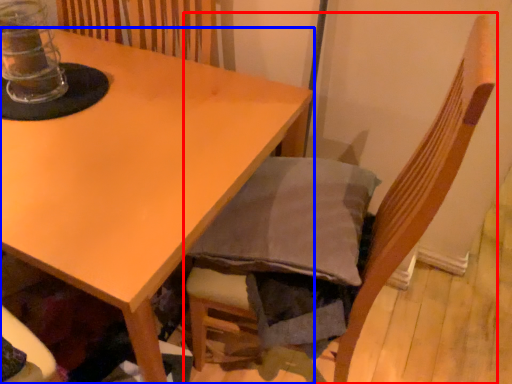
Question: Which of the following is the farthest to the observer, chair (highlighted by a red box) or table (highlighted by a blue box)?

Choices:
 (A) chair
 (B) table

Answer: (B)